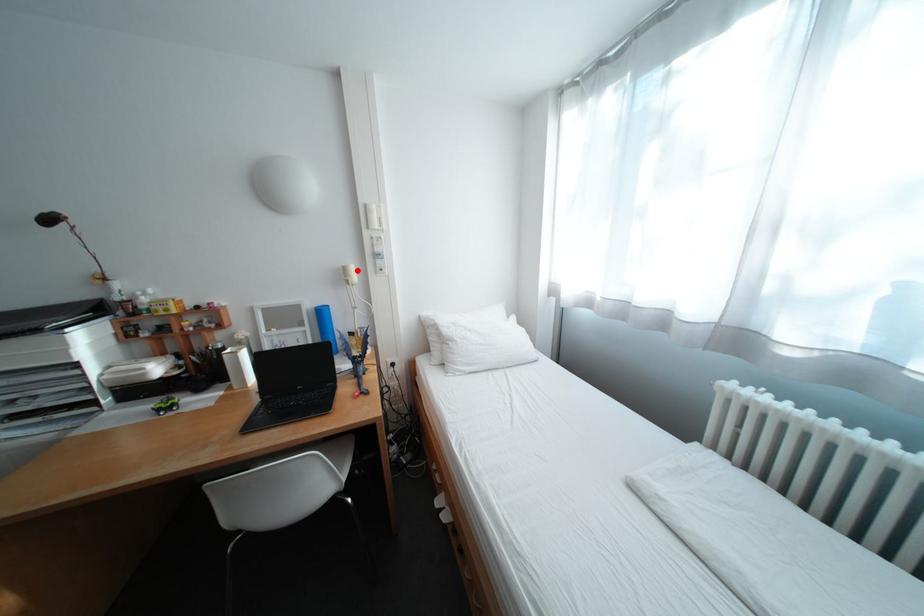
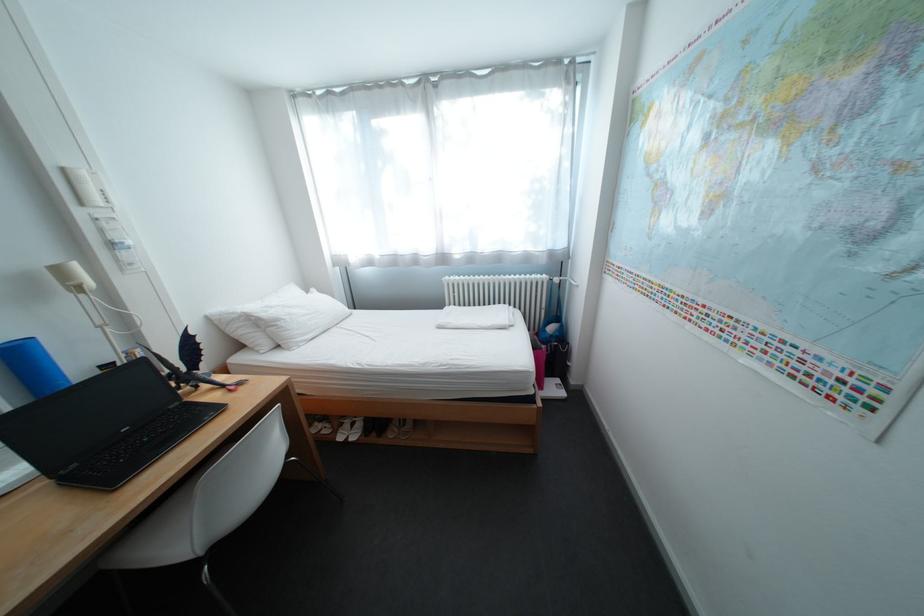
Question: I am providing you with two images of the same scene from different viewpoints. Given a red point in image1, look at the same physical point in image2. Is it:

Choices:
 (A) Closer to the viewpoint
 (B) Farther from the viewpoint

Answer: (B)